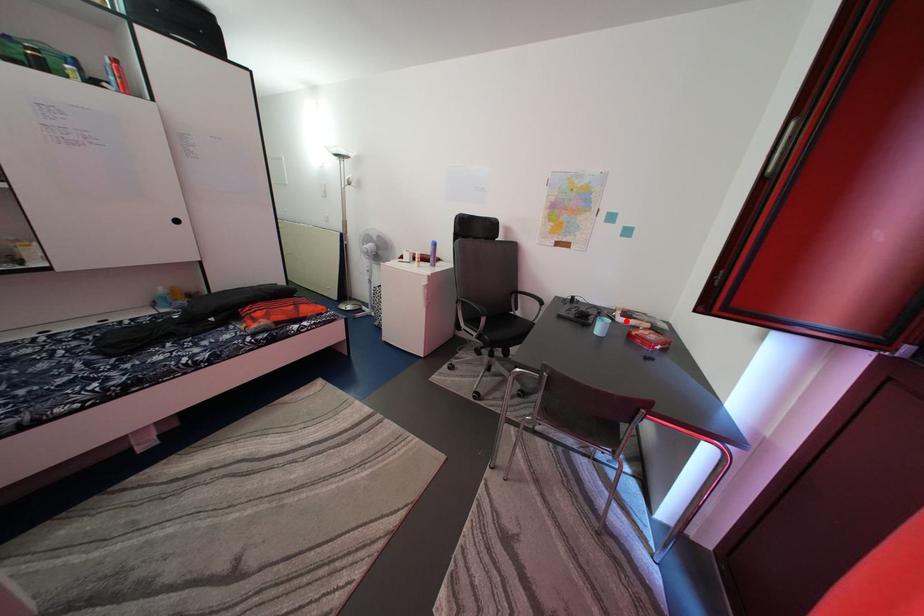
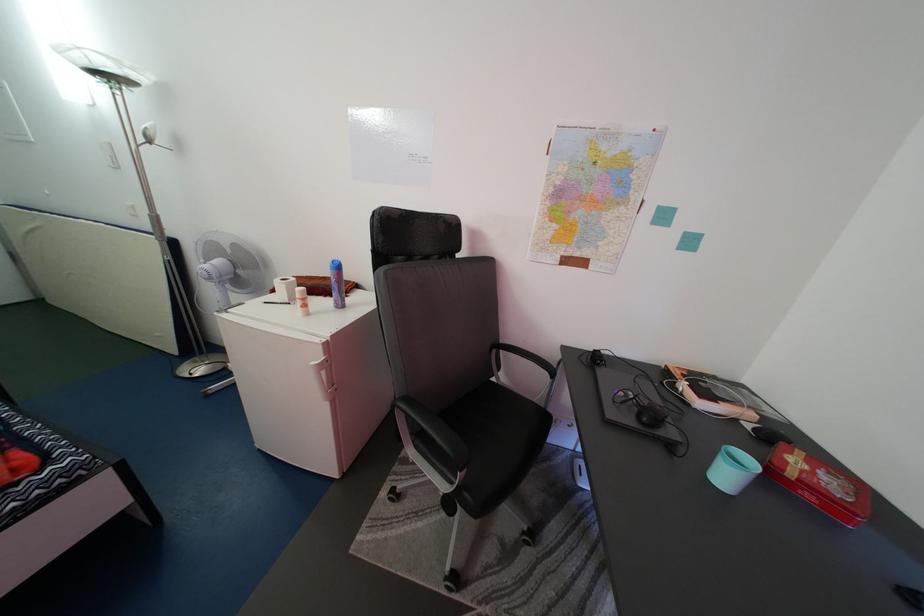
Where in the second image is the point corresponding to the highlighted location from the first image?

(691, 392)